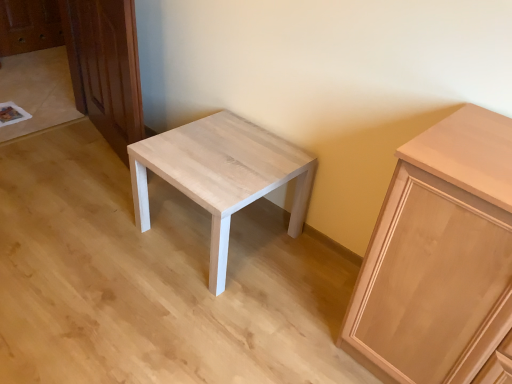
Locate an element on the screen. The image size is (512, 384). vacant area that is in front of light wood/texture stool at center is located at coordinates tap(200, 319).